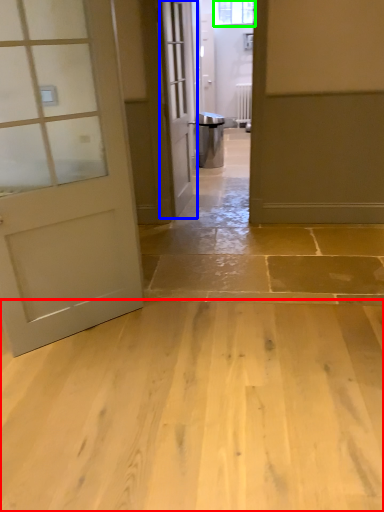
Question: Estimate the real-world distances between objects in this image. Which object is farther from concrete (highlighted by a red box), door (highlighted by a blue box) or window (highlighted by a green box)?

Choices:
 (A) door
 (B) window

Answer: (B)